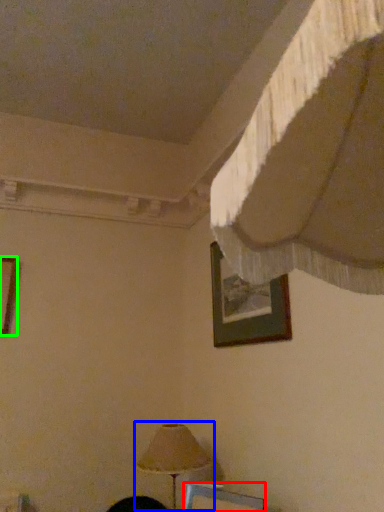
Question: Which object is the farthest from picture frame (highlighted by a red box)? Choose among these: lamp (highlighted by a blue box) or picture frame (highlighted by a green box).

Choices:
 (A) lamp
 (B) picture frame

Answer: (B)